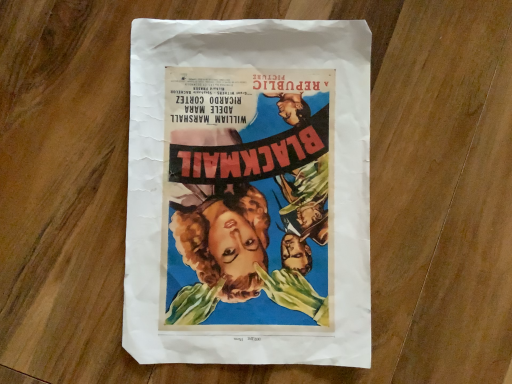
The height and width of the screenshot is (384, 512). I want to click on free space above matte paper poster at center (from a real-world perspective), so click(x=250, y=191).